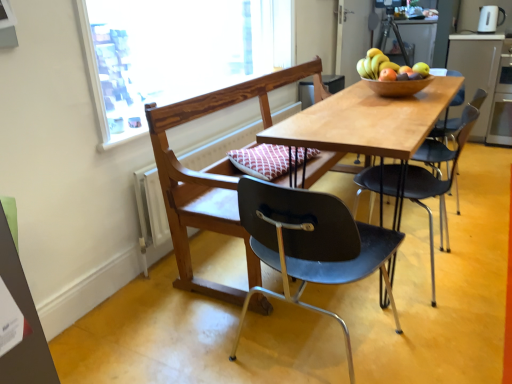
The image size is (512, 384). What are the coordinates of `free spot to the right of matte black chair at center, which appears as the first chair when viewed from the front` in the screenshot? It's located at (449, 337).